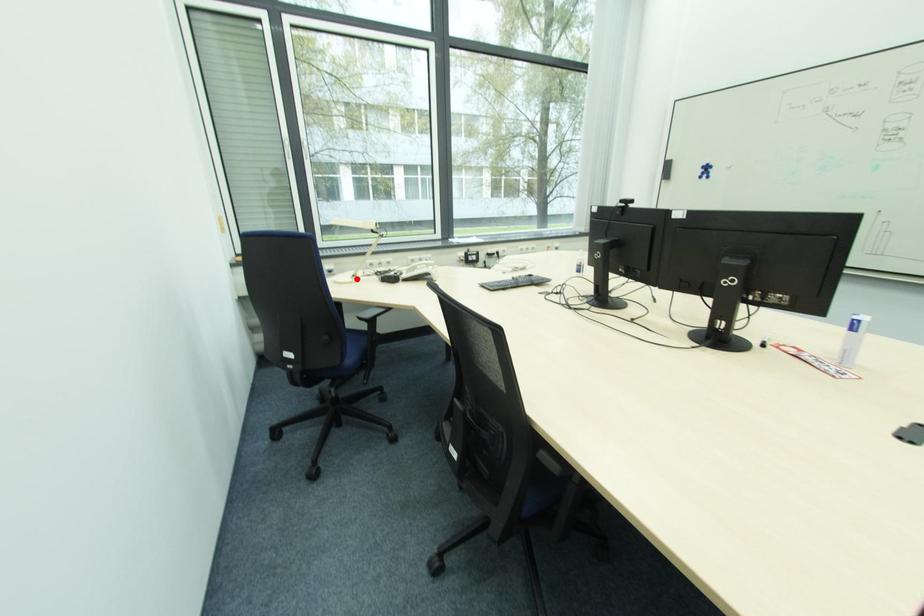
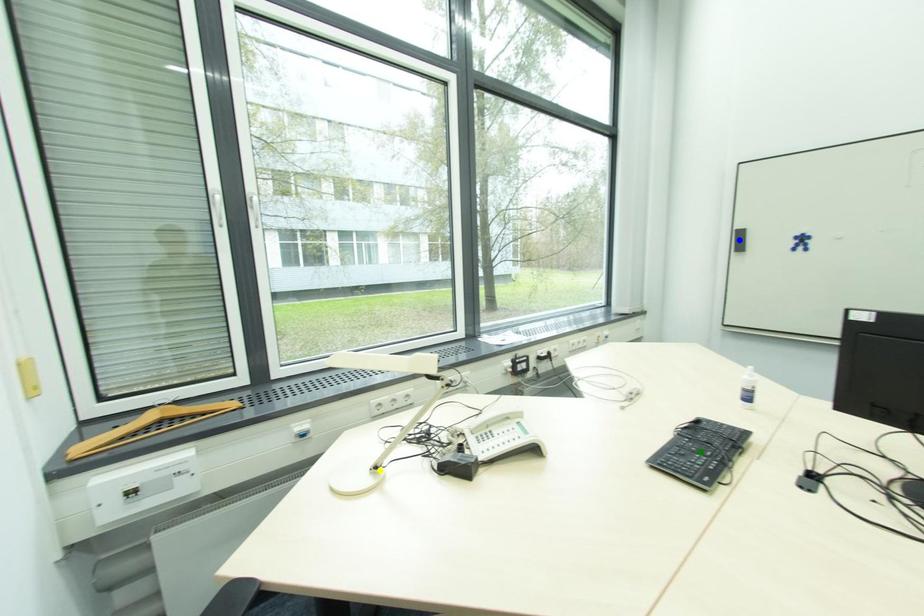
Question: I am providing you with two images of the same scene from different viewpoints. A red point is marked on the first image. You are given multiple points on the second image. In image 2, which mark is for the same physical point as the one in image 1?

Choices:
 (A) blue point
 (B) green point
 (C) yellow point

Answer: (C)